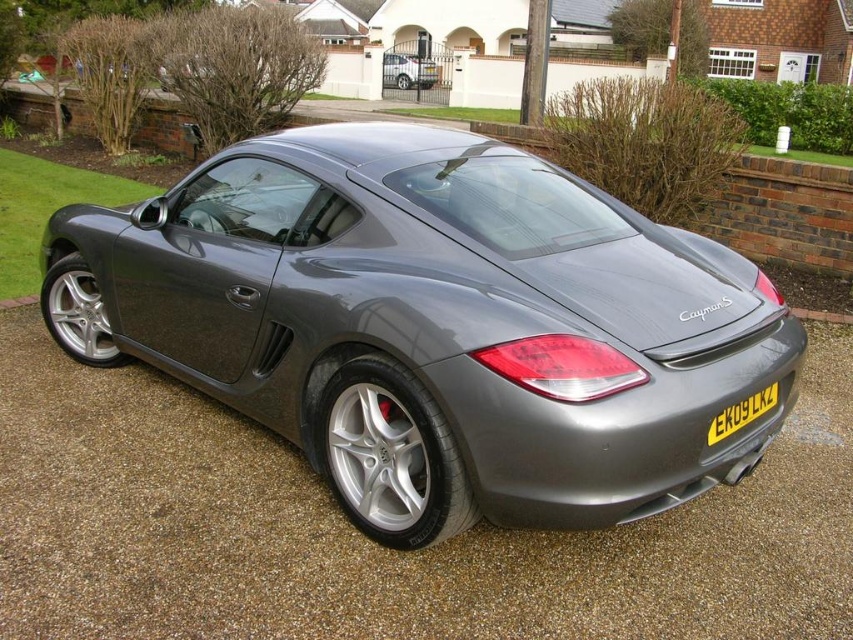
Question: Is metallic gray car at center smaller than satin silver car at center?

Choices:
 (A) yes
 (B) no

Answer: (B)

Question: In this image, where is satin metallic car at center located relative to metallic gray car at center?

Choices:
 (A) below
 (B) above

Answer: (B)

Question: Among these points, which one is nearest to the camera?

Choices:
 (A) (560, 481)
 (B) (93, 483)
 (C) (395, 54)

Answer: (A)

Question: Which point is farther from the camera taking this photo?

Choices:
 (A) (401, 308)
 (B) (427, 68)

Answer: (B)

Question: Considering the relative positions of satin metallic car at center and yellow metallic license plate at rear in the image provided, where is satin metallic car at center located with respect to yellow metallic license plate at rear?

Choices:
 (A) below
 (B) above

Answer: (B)

Question: Which point appears closest to the camera in this image?

Choices:
 (A) (390, 58)
 (B) (741, 416)
 (C) (502, 449)
 (D) (556, 541)

Answer: (C)